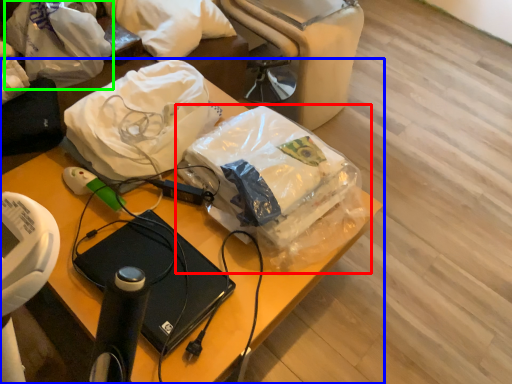
Question: Which is farther away from plastic bag (highlighted by a red box)? furniture (highlighted by a blue box) or plastic bag (highlighted by a green box)?

Choices:
 (A) furniture
 (B) plastic bag

Answer: (B)